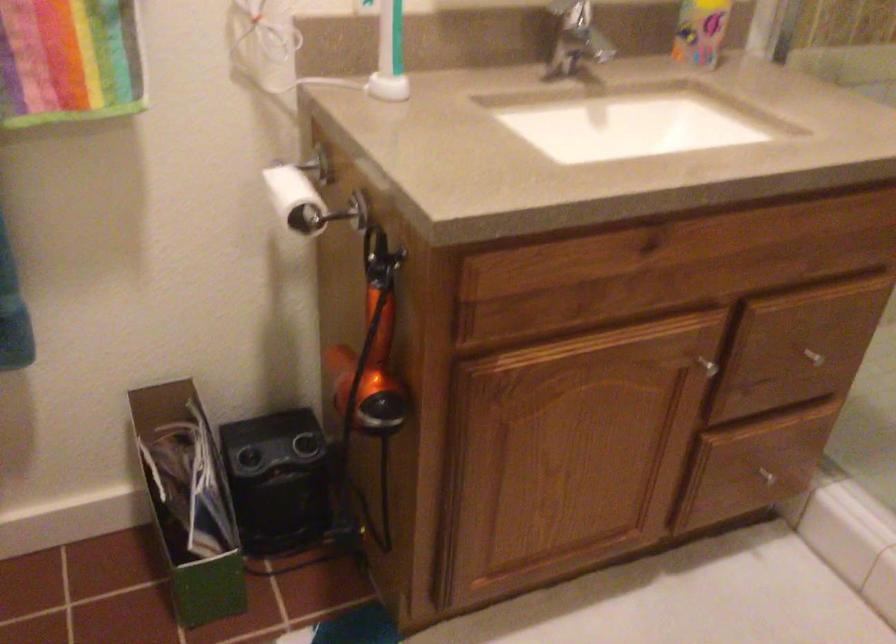
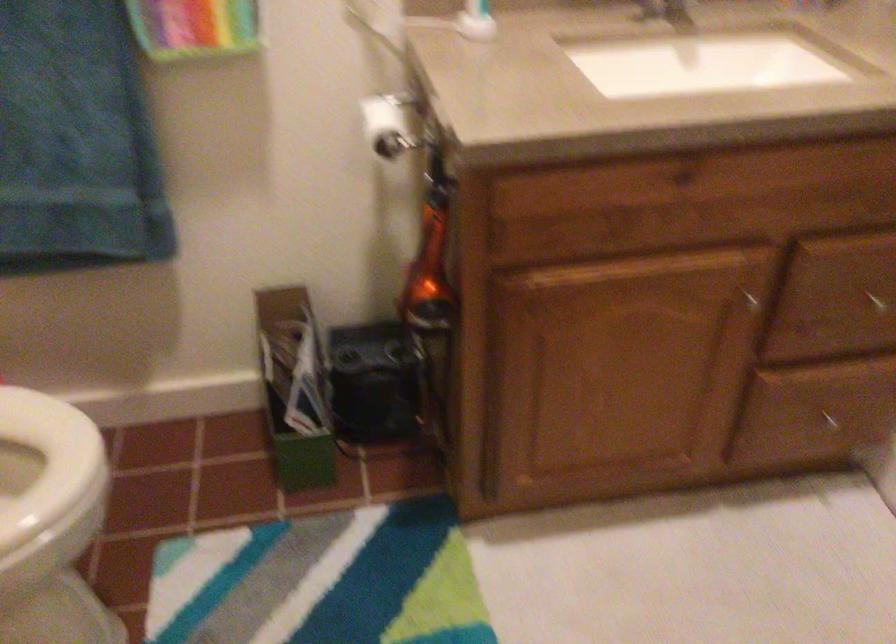
Where in the second image is the point corresponding to point 702,348 from the first image?

(752, 285)